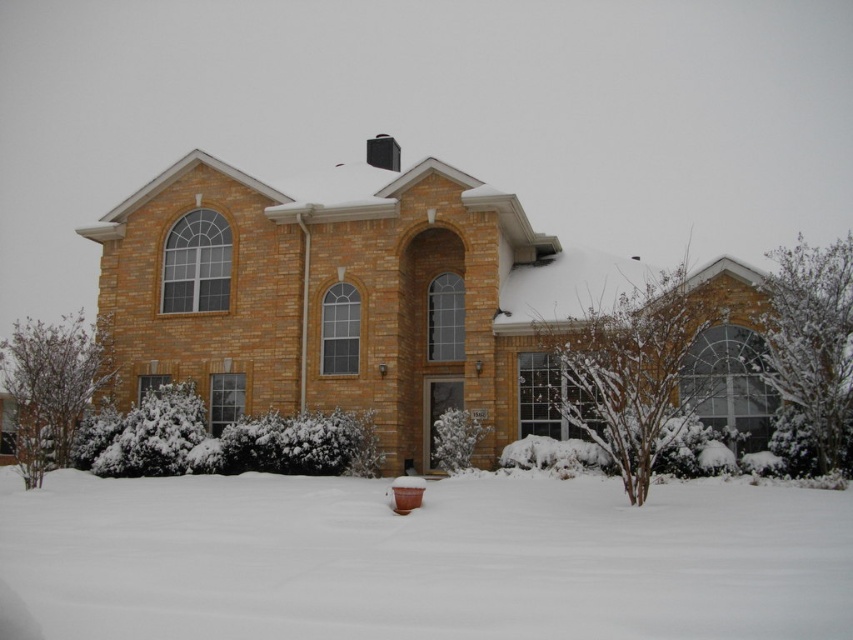
Which is below, white fluffy snow at lower center or brown brick house at center?

white fluffy snow at lower center is below.

Can you confirm if white fluffy snow at lower center is taller than brown brick house at center?

In fact, white fluffy snow at lower center may be shorter than brown brick house at center.

From the picture: Who is more forward, (781, 628) or (242, 269)?

Positioned in front is point (781, 628).

This screenshot has width=853, height=640. I want to click on white fluffy snow at lower center, so click(x=422, y=557).

Which is below, brown brick house at center or black plastic chimney at upper center?

Positioned lower is brown brick house at center.

Which is behind, point (482, 376) or point (399, 150)?

Positioned behind is point (399, 150).

At what (x,y) coordinates should I click in order to perform the action: click on brown brick house at center. Please return your answer as a coordinate pair (x, y). Looking at the image, I should click on (347, 298).

Who is more distant from viewer, [704,525] or [381,147]?

The point [381,147] is behind.

Is point (476, 632) farther from viewer compared to point (379, 164)?

No, (476, 632) is closer to viewer.

The width and height of the screenshot is (853, 640). In order to click on white fluffy snow at lower center in this screenshot , I will do `click(422, 557)`.